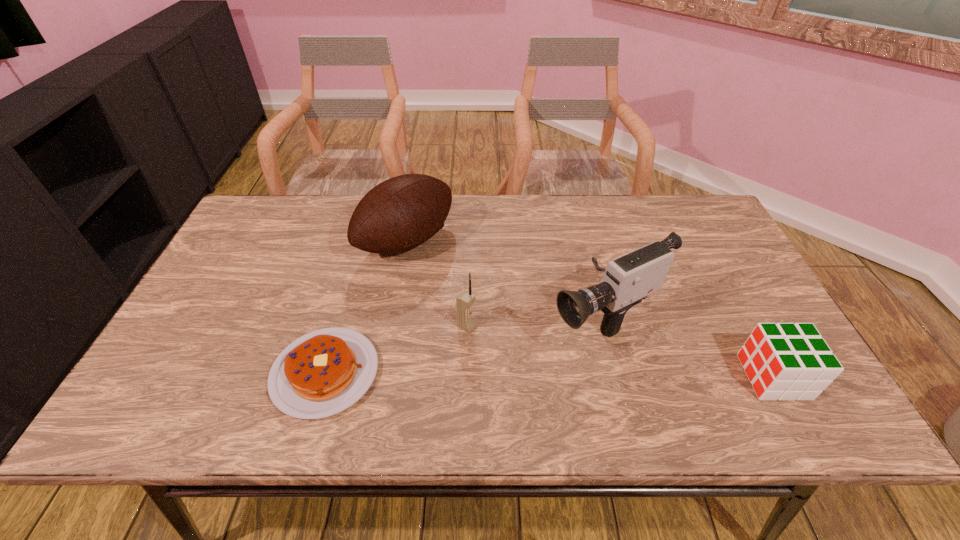
Locate an element on the screen. The width and height of the screenshot is (960, 540). free location located 0.130m on the red face of the rightmost object is located at coordinates click(689, 377).

You are a GUI agent. You are given a task and a screenshot of the screen. Output one action in this format:
    pyautogui.click(x=<x>, y=<y>)
    Task: Click on the vacant space located on the recording direction of the second object from right to left
    The image size is (960, 540).
    Given the screenshot: What is the action you would take?
    pyautogui.click(x=522, y=357)

At what (x,y) coordinates should I click in order to perform the action: click on vacant space located on the recording direction of the second object from right to left. Please return your answer as a coordinate pair (x, y). Looking at the image, I should click on (477, 380).

At what (x,y) coordinates should I click in order to perform the action: click on vacant space situated on the recording direction of the second object from right to left. Please return your answer as a coordinate pair (x, y). This screenshot has height=540, width=960. Looking at the image, I should click on (540, 349).

I want to click on free point located 0.230m on the front of the third tallest object, where the keypad is located, so click(x=558, y=378).

The image size is (960, 540). What are the coordinates of `free spot located 0.100m on the front of the third tallest object, where the keypad is located` in the screenshot? It's located at (509, 350).

At what (x,y) coordinates should I click in order to perform the action: click on free region located on the front of the third tallest object, where the keypad is located. Please return your answer as a coordinate pair (x, y). The height and width of the screenshot is (540, 960). Looking at the image, I should click on (542, 369).

The image size is (960, 540). Identify the location of vacant space located 0.170m on the laces of the football. (480, 294).

At what (x,y) coordinates should I click in order to perform the action: click on free space located on the laces of the football. Please return your answer as a coordinate pair (x, y). This screenshot has height=540, width=960. Looking at the image, I should click on (494, 303).

This screenshot has height=540, width=960. Find the location of `blank space located 0.210m on the laces of the football`. blank space located 0.210m on the laces of the football is located at coordinates (492, 301).